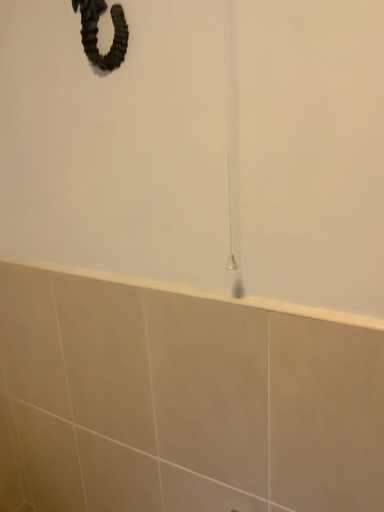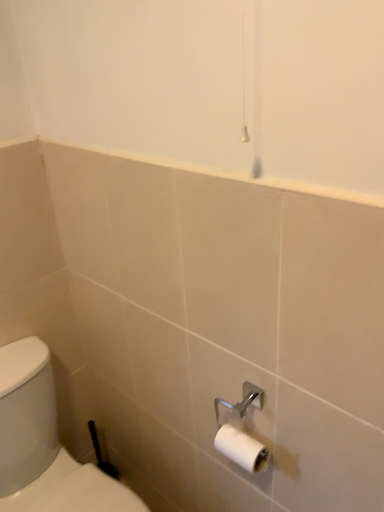
Question: Which way did the camera rotate in the video?

Choices:
 (A) rotated upward
 (B) rotated downward

Answer: (B)